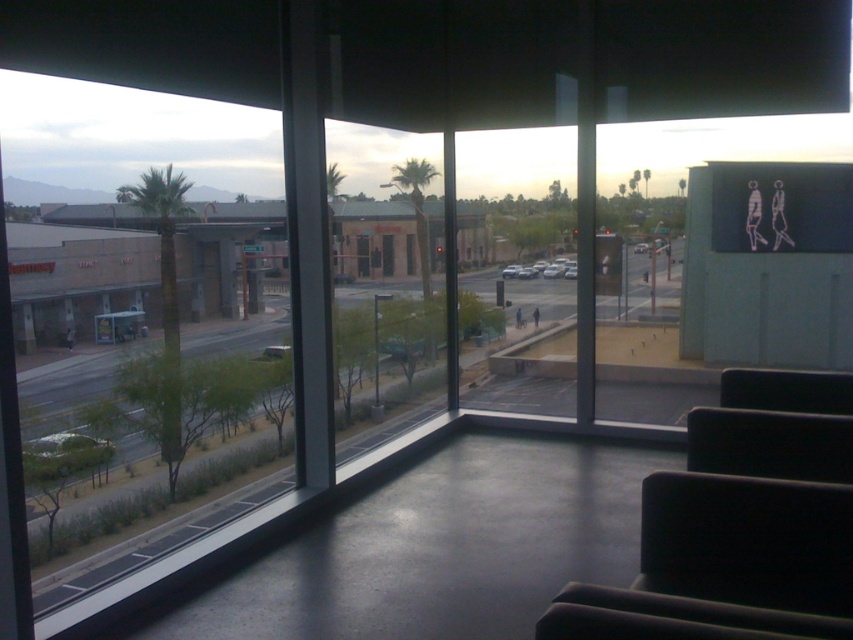
You are a delivery person trying to decide whether to place a large box on the floor between the transparent glass window at left and the black fabric armchair at lower right. The box is 1.2 meters wide. Can you fit the box in that space?

The transparent glass window at left might be wider than black fabric armchair at lower right, but without exact measurements, it is uncertain whether the space between them can accommodate a 1.2 meter wide box. Check the actual distance before placing the box.

You are standing in the modern interior space and want to move from the point at coordinates point (109,211) to the point at coordinates point (755,378). Can you walk directly between them without any obstacles?

Point (109,211) is behind point (755,378), so you cannot walk directly between them without encountering an obstacle.

You are a visitor in this space and need to observe the palm trees outside. Which object allows you to see the exterior view, and is the black fabric armchair at lower right in front of or behind the transparent glass window at left?

The transparent glass window at left allows you to see the exterior view. The black fabric armchair at lower right is behind the transparent glass window at left according to the description.